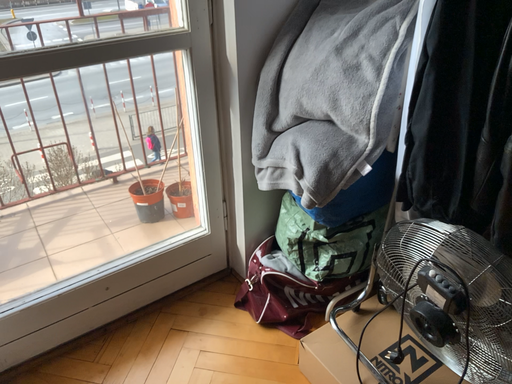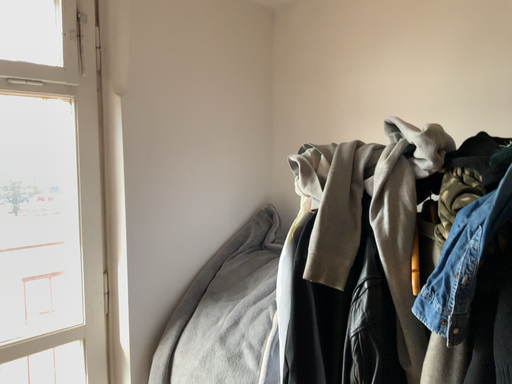
Question: Which way did the camera rotate in the video?

Choices:
 (A) rotated right
 (B) rotated left

Answer: (A)